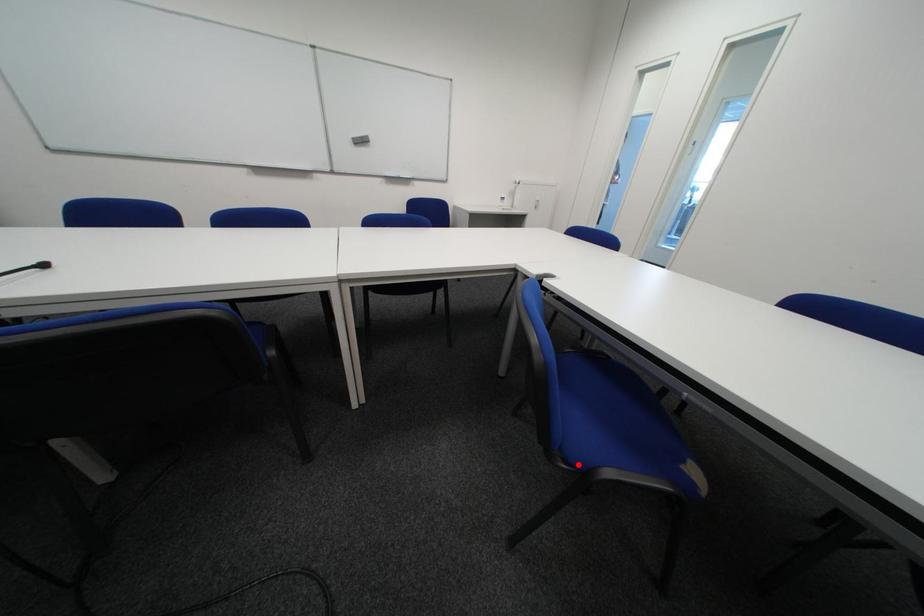
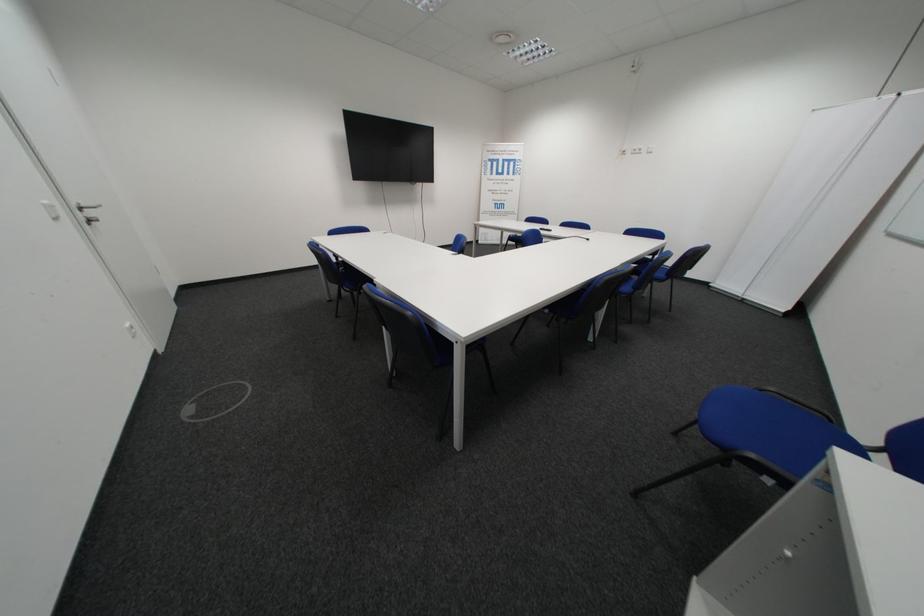
Question: I am providing you with two images of the same scene from different viewpoints. A red point is marked on the first image. Can you still see the location of the red point in image 2?

Choices:
 (A) Yes
 (B) No

Answer: (B)